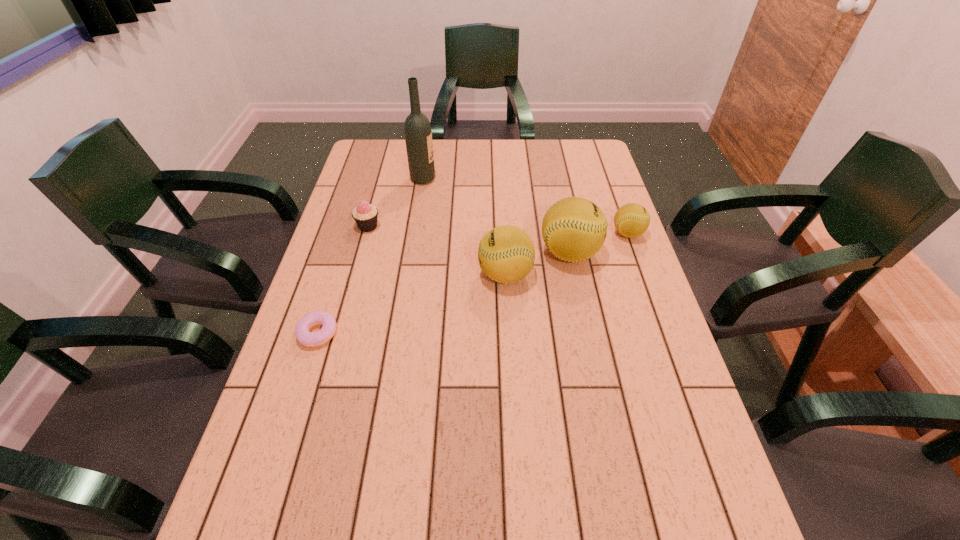
Where is `free space between the second tallest softball and the second softball from left to right`? free space between the second tallest softball and the second softball from left to right is located at coordinates (538, 264).

Identify the location of blank region between the tallest object and the shortest object. The image size is (960, 540). (371, 256).

At what (x,y) coordinates should I click in order to perform the action: click on vacant area that lies between the shortest object and the farthest object. Please return your answer as a coordinate pair (x, y). Image resolution: width=960 pixels, height=540 pixels. Looking at the image, I should click on (371, 256).

The width and height of the screenshot is (960, 540). Identify the location of blank region between the shortest object and the third tallest object. (412, 304).

This screenshot has width=960, height=540. Find the location of `vacant point located between the shortest softball and the shortest object`. vacant point located between the shortest softball and the shortest object is located at coordinates (473, 284).

Identify the location of object that is the closest to the second softball from left to right. This screenshot has width=960, height=540. (506, 254).

The height and width of the screenshot is (540, 960). I want to click on object that is the fourth closest to the cupcake, so click(574, 229).

Locate which softball is the second closest to the second shortest softball. Please provide its 2D coordinates. Your answer should be formatted as a tuple, i.e. [(x, y)], where the tuple contains the x and y coordinates of a point satisfying the conditions above.

[(631, 220)]

Find the location of `softball that is the closest to the rightmost object`. softball that is the closest to the rightmost object is located at coordinates (574, 229).

This screenshot has height=540, width=960. What are the coordinates of `free region that satisfies the following two spatial constraints: 1. on the back side of the cupcake; 2. on the right side of the shortest object` in the screenshot? It's located at (352, 226).